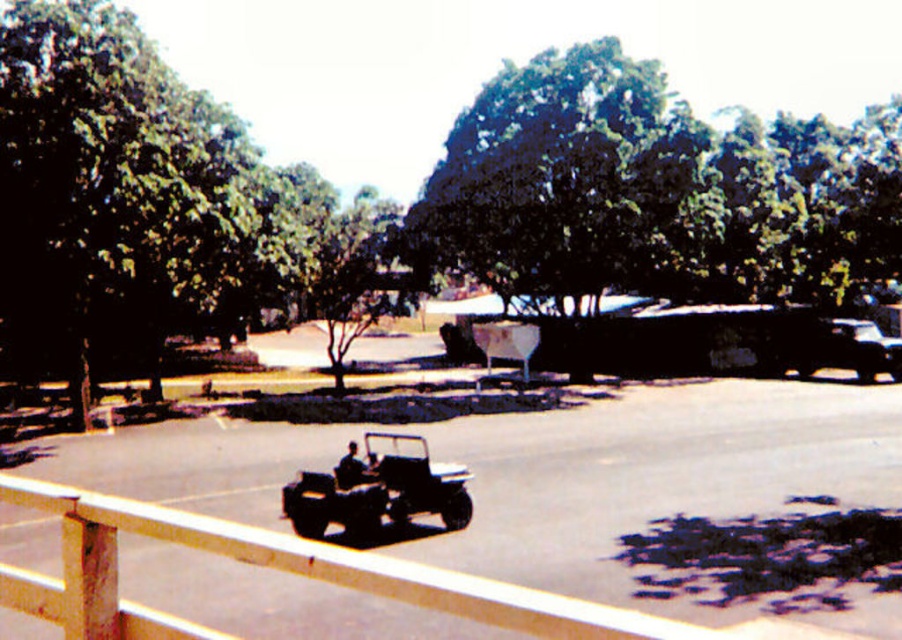
Question: Can you confirm if green leafy tree at upper left is wider than metallic silver jeep at lower center?

Choices:
 (A) no
 (B) yes

Answer: (B)

Question: Which object is closer to the camera taking this photo?

Choices:
 (A) green leafy tree at upper left
 (B) wooden fence at lower center

Answer: (B)

Question: Estimate the real-world distances between objects in this image. Which object is closer to the wooden fence at lower center?

Choices:
 (A) green leafy tree at upper left
 (B) metallic silver jeep at lower center
 (C) green leafy tree at center

Answer: (B)

Question: Does green leafy tree at upper left have a lesser width compared to metallic silver jeep at lower center?

Choices:
 (A) yes
 (B) no

Answer: (B)

Question: From the image, what is the correct spatial relationship of green leafy tree at upper left in relation to wooden fence at lower center?

Choices:
 (A) above
 (B) below

Answer: (A)

Question: Which of these objects is positioned closest to the green leafy tree at upper left?

Choices:
 (A) metallic silver jeep at lower center
 (B) wooden fence at lower center
 (C) green leafy tree at center

Answer: (C)